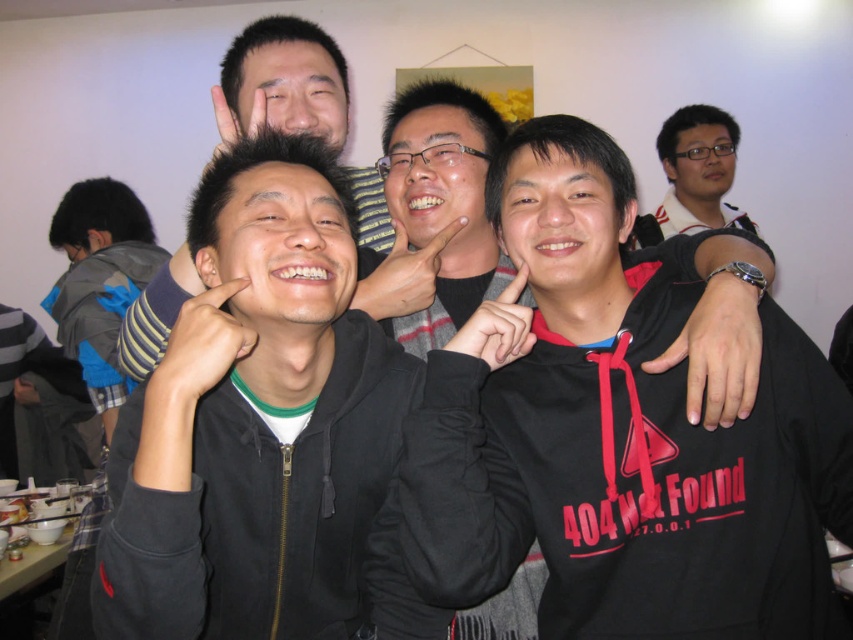
Question: Can you confirm if black matte jacket at center is thinner than matte black hoodie at center?

Choices:
 (A) yes
 (B) no

Answer: (A)

Question: Which of the following is the closest to the observer?

Choices:
 (A) (248, 116)
 (B) (386, 260)
 (C) (287, 616)

Answer: (C)

Question: Is black matte jacket at center thinner than matte black hoodie at center?

Choices:
 (A) no
 (B) yes

Answer: (B)

Question: Which of these objects is positioned farthest from the black matte hoodie at center?

Choices:
 (A) black matte jacket at center
 (B) matte black hoodie at center
 (C) matte black hand at upper center
 (D) matte black hand at center

Answer: (C)

Question: Does black matte hand at center appear over matte skin hand at center?

Choices:
 (A) yes
 (B) no

Answer: (B)

Question: Which point is closer to the camera taking this photo?

Choices:
 (A) (154, 394)
 (B) (112, 378)

Answer: (A)